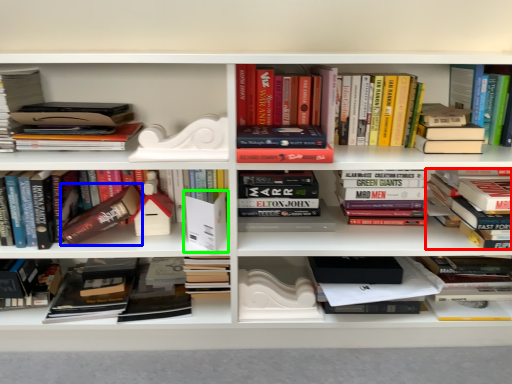
Question: Which object is positioned farthest from book (highlighted by a red box)? Select from paperback book (highlighted by a blue box) and paperback book (highlighted by a green box).

Choices:
 (A) paperback book
 (B) paperback book

Answer: (A)